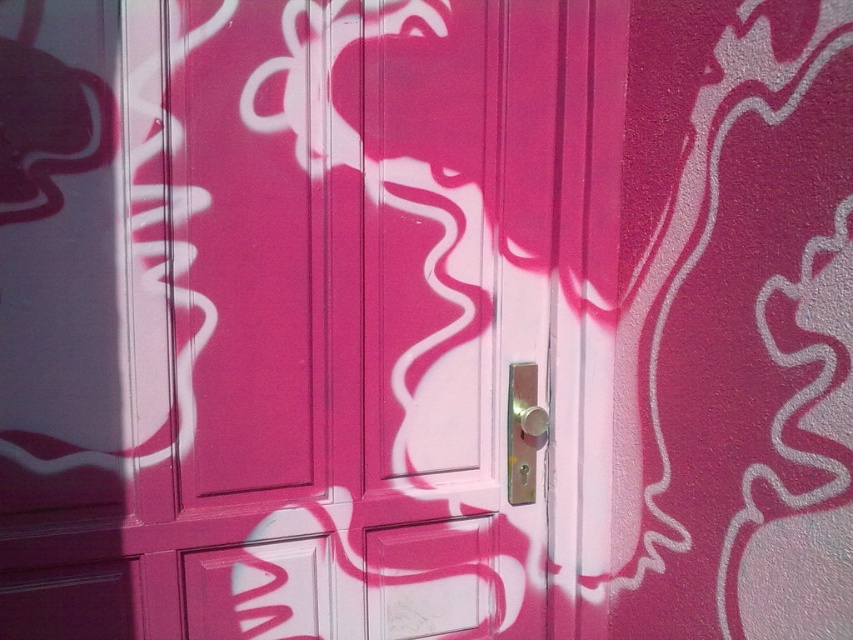
You are trying to open the door by turning the metallic gold door handle at center. However, you notice the matte pink door at center is blocking access to the handle. Can you still turn the handle easily?

The matte pink door at center is in front of the metallic gold door handle at center, so the door is blocking the handle. This might make it difficult to turn the handle easily.

You are a painter who wants to add a new design to the matte pink door at center and the metallic gold door handle at center. Which object requires more vertical space for the design?

The matte pink door at center requires more vertical space for the design because it is much taller than the metallic gold door handle at center.

You are a painter who wants to paint a stripe along the edge of the matte pink door at center. The stripe should be as wide as the metallic gold door handle at center. Is the door wide enough to accommodate this stripe?

The matte pink door at center might be wider than metallic gold door handle at center, so it is possible that the door is wide enough to accommodate a stripe as wide as the handle. However, since the exact width difference isn not specified, the painter should measure both to ensure the stripe fits.